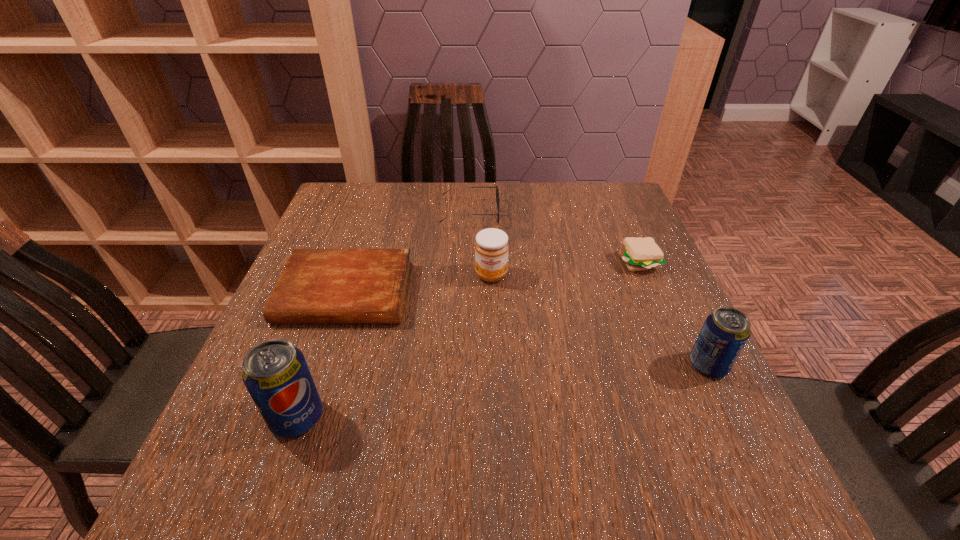
Identify the location of free space that satisfies the following two spatial constraints: 1. through the lenses of the farthest object; 2. on the spine side of the Bible. The width and height of the screenshot is (960, 540). (468, 293).